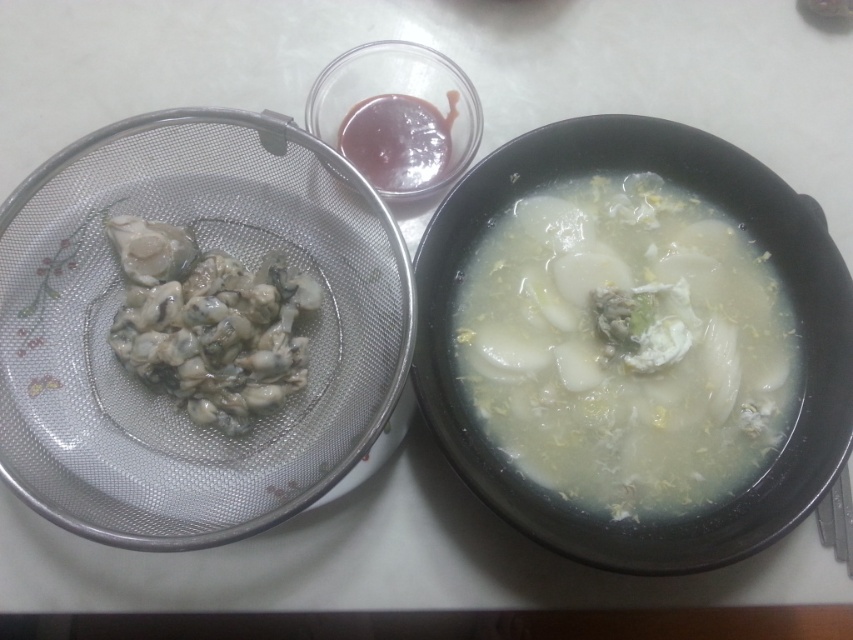
Who is positioned more to the left, grayish translucent oyster at left or smooth glossy sauce at upper center?

grayish translucent oyster at left is more to the left.

Does grayish translucent oyster at left appear on the right side of smooth glossy sauce at upper center?

In fact, grayish translucent oyster at left is to the left of smooth glossy sauce at upper center.

You are a GUI agent. You are given a task and a screenshot of the screen. Output one action in this format:
    pyautogui.click(x=<x>, y=<y>)
    Task: Click on the grayish translucent oyster at left
    The image size is (853, 640).
    Given the screenshot: What is the action you would take?
    pyautogui.click(x=209, y=323)

What do you see at coordinates (625, 346) in the screenshot?
I see `white translucent soup at center` at bounding box center [625, 346].

Does white translucent soup at center have a greater height compared to grayish translucent oyster at left?

Correct, white translucent soup at center is much taller as grayish translucent oyster at left.

Where is `white translucent soup at center`? Image resolution: width=853 pixels, height=640 pixels. white translucent soup at center is located at coordinates (625, 346).

Where is `white translucent soup at center`? Image resolution: width=853 pixels, height=640 pixels. white translucent soup at center is located at coordinates (625, 346).

Is white translucent soup at center bigger than smooth glossy sauce at upper center?

Correct, white translucent soup at center is larger in size than smooth glossy sauce at upper center.

Does white translucent soup at center have a smaller size compared to smooth glossy sauce at upper center?

Actually, white translucent soup at center might be larger than smooth glossy sauce at upper center.

Is point (737, 483) farther from viewer compared to point (399, 161)?

No, it is in front of (399, 161).

Identify the location of white translucent soup at center. Image resolution: width=853 pixels, height=640 pixels. (625, 346).